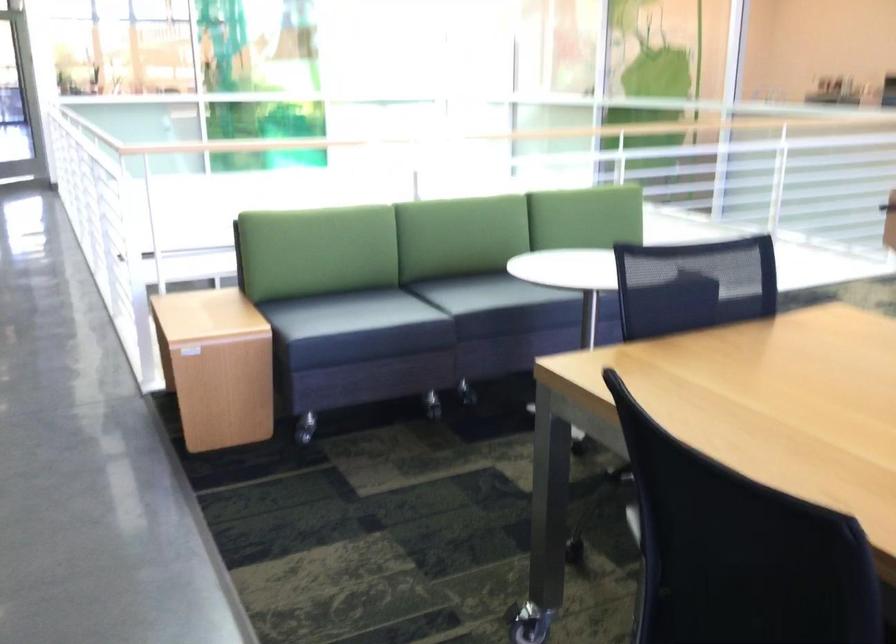
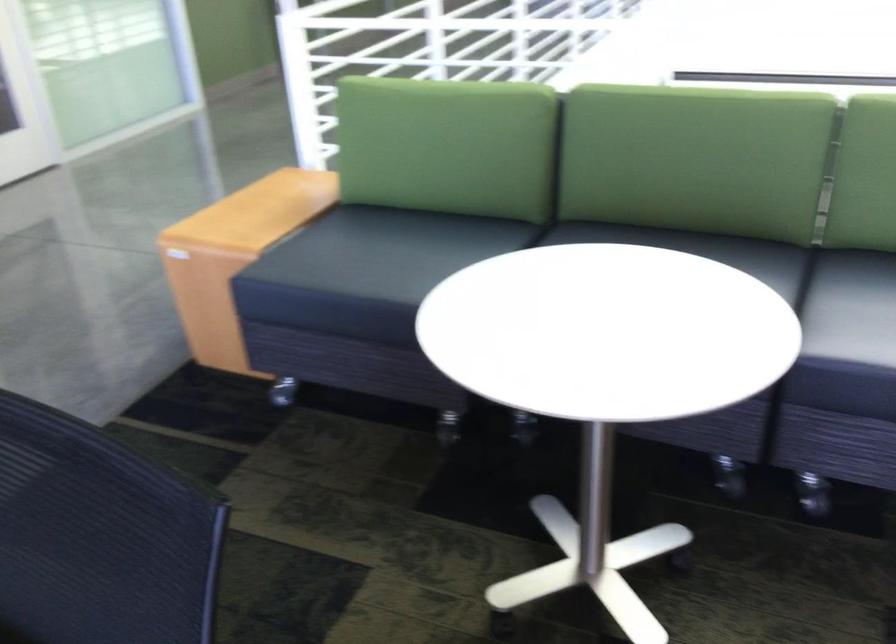
In the second image, find the point that corresponds to point 348,313 in the first image.

(475, 278)